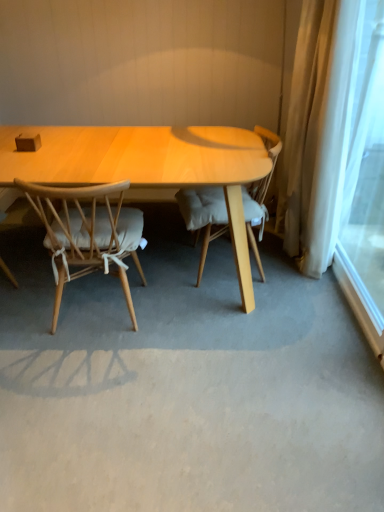
Question: Is white sheer curtain at right wider than light brown wood chair at center, marked as the 1th chair in a right-to-left arrangement?

Choices:
 (A) yes
 (B) no

Answer: (B)

Question: From the image's perspective, is white sheer curtain at right under light brown wood chair at center, the 2th chair positioned from the left?

Choices:
 (A) no
 (B) yes

Answer: (A)

Question: Does white sheer curtain at right have a greater height compared to light brown wood chair at center, the 2th chair positioned from the left?

Choices:
 (A) no
 (B) yes

Answer: (B)

Question: Is light brown wood chair at center, the 2th chair positioned from the left, surrounded by white sheer curtain at right?

Choices:
 (A) yes
 (B) no

Answer: (B)

Question: Is white sheer curtain at right bigger than light brown wood chair at center, the 2th chair positioned from the left?

Choices:
 (A) no
 (B) yes

Answer: (A)

Question: Relative to light wood chair with cushion at left, arranged as the 2th chair when viewed from the right, is white sheer curtain at right in front or behind?

Choices:
 (A) behind
 (B) front

Answer: (B)

Question: Based on their sizes in the image, would you say white sheer curtain at right is bigger or smaller than light wood chair with cushion at left, arranged as the 2th chair when viewed from the right?

Choices:
 (A) big
 (B) small

Answer: (B)

Question: Is white sheer curtain at right to the left or to the right of light wood chair with cushion at left, which is counted as the 1th chair, starting from the left, in the image?

Choices:
 (A) right
 (B) left

Answer: (A)

Question: Is white sheer curtain at right wider or thinner than light wood chair with cushion at left, which is counted as the 1th chair, starting from the left?

Choices:
 (A) thin
 (B) wide

Answer: (A)

Question: Based on their sizes in the image, would you say light brown wood chair at center, marked as the 1th chair in a right-to-left arrangement, is bigger or smaller than white sheer curtain at right?

Choices:
 (A) small
 (B) big

Answer: (B)

Question: Choose the correct answer: Is light brown wood chair at center, the 2th chair positioned from the left, inside white sheer curtain at right or outside it?

Choices:
 (A) outside
 (B) inside

Answer: (A)

Question: Is light brown wood chair at center, marked as the 1th chair in a right-to-left arrangement, taller or shorter than white sheer curtain at right?

Choices:
 (A) tall
 (B) short

Answer: (B)

Question: Based on their positions, is light brown wood chair at center, the 2th chair positioned from the left, located to the left or right of white sheer curtain at right?

Choices:
 (A) right
 (B) left

Answer: (B)

Question: Is light wood chair with cushion at left, arranged as the 2th chair when viewed from the right, in front of or behind light brown wood chair at center, the 2th chair positioned from the left, in the image?

Choices:
 (A) front
 (B) behind

Answer: (A)

Question: Choose the correct answer: Is light wood chair with cushion at left, which is counted as the 1th chair, starting from the left, inside light brown wood chair at center, marked as the 1th chair in a right-to-left arrangement, or outside it?

Choices:
 (A) inside
 (B) outside

Answer: (B)